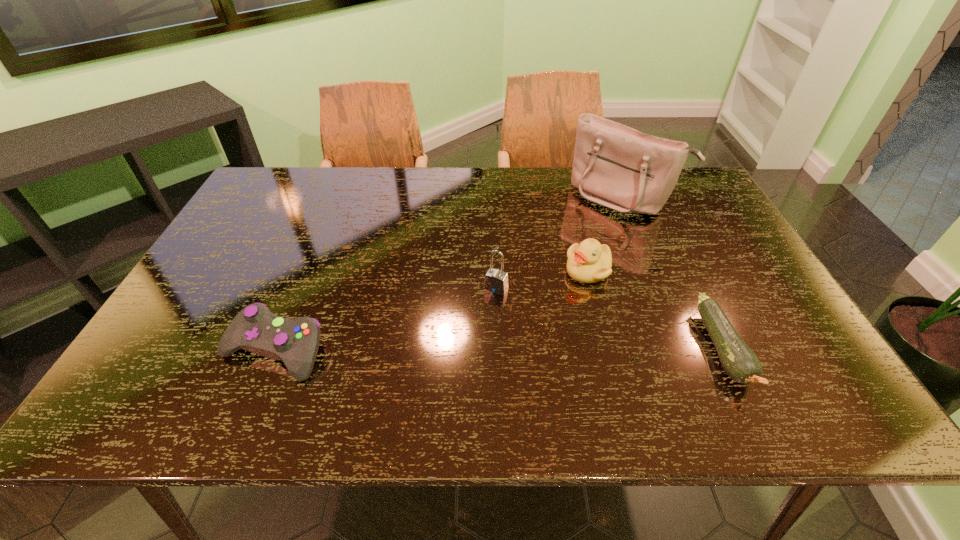
Find the location of a particular element. The width and height of the screenshot is (960, 540). blank area located 0.210m on the beak of the duckling is located at coordinates (554, 346).

You are a GUI agent. You are given a task and a screenshot of the screen. Output one action in this format:
    pyautogui.click(x=<x>, y=<y>)
    Task: Click on the blank space located 0.190m on the beak of the duckling
    The width and height of the screenshot is (960, 540).
    Given the screenshot: What is the action you would take?
    pyautogui.click(x=557, y=340)

Where is `vacant space located on the shackle of the padlock`? The height and width of the screenshot is (540, 960). vacant space located on the shackle of the padlock is located at coordinates (463, 342).

The height and width of the screenshot is (540, 960). I want to click on free space located 0.060m on the shackle of the padlock, so click(481, 312).

At what (x,y) coordinates should I click in order to perform the action: click on vacant space situated 0.200m on the shackle of the padlock. Please return your answer as a coordinate pair (x, y). The height and width of the screenshot is (540, 960). Looking at the image, I should click on (455, 355).

Identify the location of free spot located on the front pocket of the farthest object. (582, 233).

You are a GUI agent. You are given a task and a screenshot of the screen. Output one action in this format:
    pyautogui.click(x=<x>, y=<y>)
    Task: Click on the blank space located 0.080m on the front pocket of the farthest object
    This screenshot has width=960, height=540.
    Given the screenshot: What is the action you would take?
    pyautogui.click(x=585, y=230)

Identify the location of free space located on the front pocket of the farthest object. Image resolution: width=960 pixels, height=540 pixels. (571, 244).

I want to click on object positioned at the far edge, so click(616, 166).

Find the location of a particular element. control that is at the near edge is located at coordinates (255, 328).